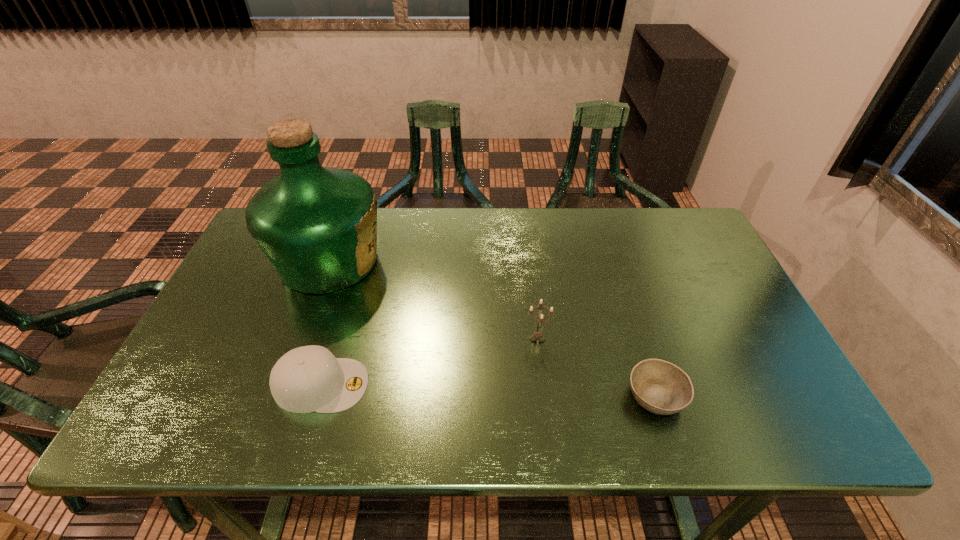
I want to click on blank space that satisfies the following two spatial constraints: 1. on the front-facing side of the second shortest object; 2. on the left side of the bowl, so click(x=318, y=396).

The height and width of the screenshot is (540, 960). I want to click on blank area in the image that satisfies the following two spatial constraints: 1. on the label side of the tallest object; 2. on the right side of the rightmost object, so click(280, 396).

The height and width of the screenshot is (540, 960). I want to click on vacant space that satisfies the following two spatial constraints: 1. on the label side of the rightmost object; 2. on the left side of the tallest object, so click(x=280, y=396).

The width and height of the screenshot is (960, 540). I want to click on vacant area in the image that satisfies the following two spatial constraints: 1. on the front-facing side of the second shortest object; 2. on the right side of the bowl, so click(318, 396).